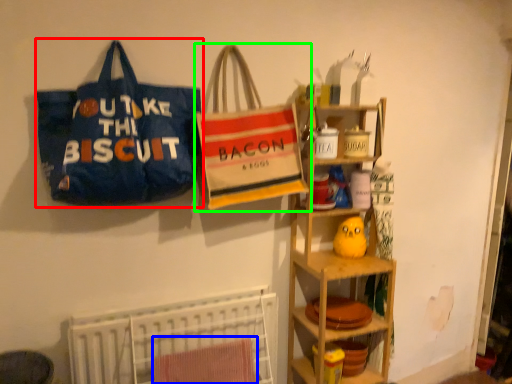
Question: Which object is the farthest from handbag (highlighted by a red box)? Choose among these: beach towel (highlighted by a blue box) or handbag (highlighted by a green box).

Choices:
 (A) beach towel
 (B) handbag

Answer: (A)